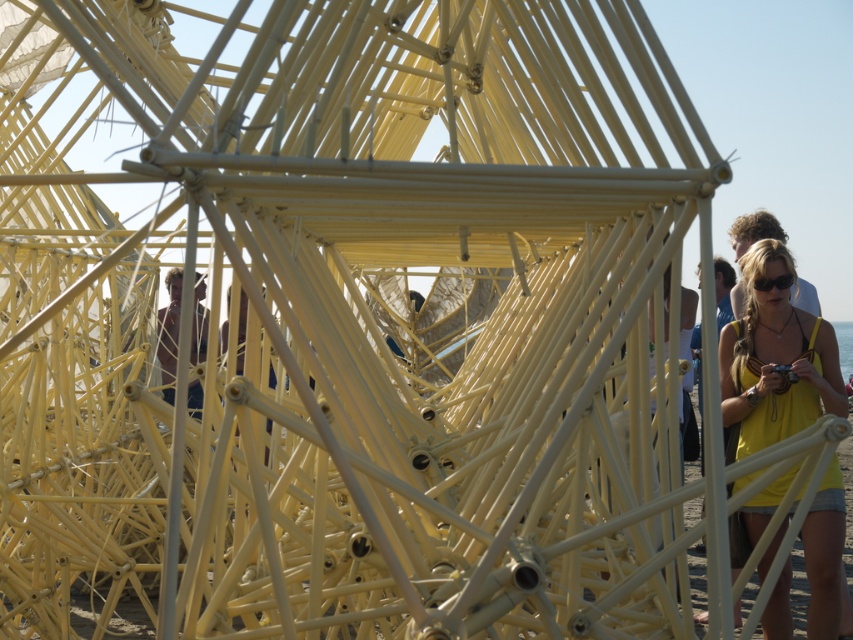
Question: Which object appears closest to the camera in this image?

Choices:
 (A) yellow fabric top at right
 (B) black matte sunglasses at center

Answer: (A)

Question: Does yellow fabric top at right have a lesser width compared to black matte sunglasses at center?

Choices:
 (A) yes
 (B) no

Answer: (B)

Question: Does yellow fabric top at right appear over black matte sunglasses at center?

Choices:
 (A) yes
 (B) no

Answer: (B)

Question: Is yellow fabric top at right thinner than black matte sunglasses at center?

Choices:
 (A) yes
 (B) no

Answer: (B)

Question: Which point is farther from the camera taking this photo?

Choices:
 (A) (844, 509)
 (B) (782, 278)

Answer: (B)